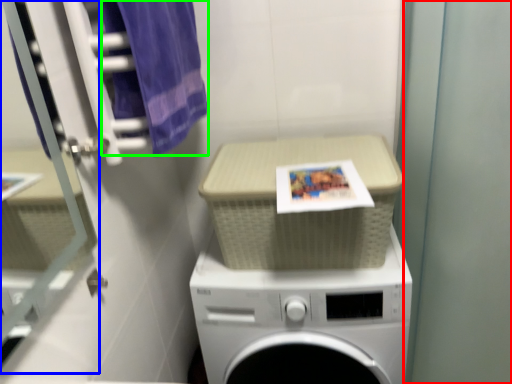
Question: Considering the real-world distances, which object is closest to screen door (highlighted by a red box)? glass door (highlighted by a blue box) or bath towel (highlighted by a green box).

Choices:
 (A) glass door
 (B) bath towel

Answer: (B)